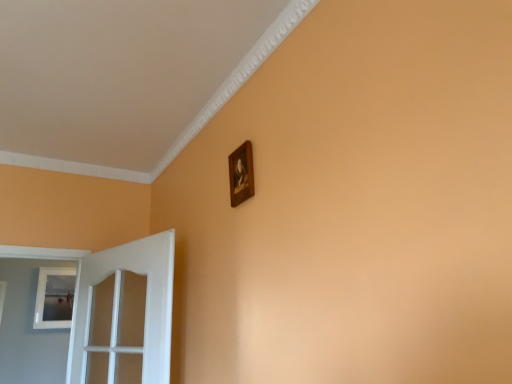
Locate an element on the screen. The height and width of the screenshot is (384, 512). wooden frame at upper center, which appears as the 2th picture frame when ordered from the bottom is located at coordinates click(x=241, y=174).

Locate an element on the screen. wooden frame at upper center, which appears as the 2th picture frame when ordered from the bottom is located at coordinates (241, 174).

Considering the relative positions of white matte picture frame at left, which ranks as the 1th picture frame in left-to-right order, and white glossy door at left in the image provided, is white matte picture frame at left, which ranks as the 1th picture frame in left-to-right order, to the left or to the right of white glossy door at left?

In the image, white matte picture frame at left, which ranks as the 1th picture frame in left-to-right order, appears on the left side of white glossy door at left.

Is white matte picture frame at left, which ranks as the second picture frame in front-to-back order, inside the boundaries of white glossy door at left, or outside?

white matte picture frame at left, which ranks as the second picture frame in front-to-back order, lies outside white glossy door at left.

Which is in front, point (229, 166) or point (69, 268)?

Positioned in front is point (229, 166).

Is wooden frame at upper center, which is counted as the 1th picture frame, starting from the front, with white matte picture frame at left, which ranks as the 1th picture frame in left-to-right order?

No.

Considering the sizes of objects wooden frame at upper center, the first picture frame in the right-to-left sequence, and white matte picture frame at left, positioned as the 2th picture frame in top-to-bottom order, in the image provided, who is wider, wooden frame at upper center, the first picture frame in the right-to-left sequence, or white matte picture frame at left, positioned as the 2th picture frame in top-to-bottom order,?

With larger width is white matte picture frame at left, positioned as the 2th picture frame in top-to-bottom order.

Is wooden frame at upper center, which is the second picture frame in left-to-right order, next to white glossy door at left?

No, wooden frame at upper center, which is the second picture frame in left-to-right order, is not making contact with white glossy door at left.

From their relative heights in the image, would you say wooden frame at upper center, which is the 2th picture frame from back to front, is taller or shorter than white glossy door at left?

In the image, wooden frame at upper center, which is the 2th picture frame from back to front, appears to be shorter than white glossy door at left.

In the scene shown: Is white matte picture frame at left, which is counted as the first picture frame, starting from the back, positioned far away from wooden frame at upper center, which is counted as the 1th picture frame, starting from the front?

Yes, white matte picture frame at left, which is counted as the first picture frame, starting from the back, and wooden frame at upper center, which is counted as the 1th picture frame, starting from the front, are located far from each other.

Does white matte picture frame at left, which ranks as the 1th picture frame in left-to-right order, appear on the right side of wooden frame at upper center, the first picture frame in the right-to-left sequence?

No.

Considering the relative sizes of white matte picture frame at left, which ranks as the 1th picture frame in left-to-right order, and wooden frame at upper center, the first picture frame in the right-to-left sequence, in the image provided, is white matte picture frame at left, which ranks as the 1th picture frame in left-to-right order, thinner than wooden frame at upper center, the first picture frame in the right-to-left sequence,?

In fact, white matte picture frame at left, which ranks as the 1th picture frame in left-to-right order, might be wider than wooden frame at upper center, the first picture frame in the right-to-left sequence.

Is white matte picture frame at left, positioned as the 2th picture frame in top-to-bottom order, oriented away from wooden frame at upper center, which appears as the 2th picture frame when ordered from the bottom?

No, white matte picture frame at left, positioned as the 2th picture frame in top-to-bottom order, is not facing away from wooden frame at upper center, which appears as the 2th picture frame when ordered from the bottom.

Consider the image. Is the position of white glossy door at left less distant than that of wooden frame at upper center, which is the second picture frame in left-to-right order?

No, it is not.

Is white glossy door at left completely or partially outside of wooden frame at upper center, the first picture frame in the right-to-left sequence?

Yes, white glossy door at left is located beyond the bounds of wooden frame at upper center, the first picture frame in the right-to-left sequence.

Between white glossy door at left and wooden frame at upper center, which is the second picture frame in left-to-right order, which one has larger size?

With larger size is white glossy door at left.

Is white glossy door at left positioned beyond the bounds of white matte picture frame at left, positioned as the 2th picture frame in top-to-bottom order?

Yes, white glossy door at left is outside of white matte picture frame at left, positioned as the 2th picture frame in top-to-bottom order.

Is point (159, 358) farther from viewer compared to point (35, 325)?

That is False.

From the image's perspective, is white glossy door at left on top of white matte picture frame at left, positioned as the 2th picture frame in top-to-bottom order?

Indeed, from the image's perspective, white glossy door at left is shown above white matte picture frame at left, positioned as the 2th picture frame in top-to-bottom order.

Does white glossy door at left come in front of white matte picture frame at left, arranged as the 2th picture frame when viewed from the right?

Yes, it is.

Identify the location of door to the right of white matte picture frame at left, which is counted as the first picture frame, starting from the back. (119, 307).

At what (x,y) coordinates should I click in order to perform the action: click on picture frame above the white matte picture frame at left, which is counted as the first picture frame, starting from the back (from a real-world perspective). Please return your answer as a coordinate pair (x, y). Looking at the image, I should click on (241, 174).

When comparing their distances from white glossy door at left, does white matte picture frame at left, positioned as the 2th picture frame in top-to-bottom order, or wooden frame at upper center, which is counted as the 1th picture frame, starting from the front, seem closer?

The object closer to white glossy door at left is wooden frame at upper center, which is counted as the 1th picture frame, starting from the front.

Based on their spatial positions, is white glossy door at left or wooden frame at upper center, which is counted as the 1th picture frame, starting from the front, further from white matte picture frame at left, acting as the 1th picture frame starting from the bottom?

The object further to white matte picture frame at left, acting as the 1th picture frame starting from the bottom, is wooden frame at upper center, which is counted as the 1th picture frame, starting from the front.

Which object lies further to the anchor point white glossy door at left, wooden frame at upper center, which is the 2th picture frame from back to front, or white matte picture frame at left, positioned as the 2th picture frame in top-to-bottom order?

white matte picture frame at left, positioned as the 2th picture frame in top-to-bottom order, is further to white glossy door at left.

Which object lies nearer to the anchor point white matte picture frame at left, which is counted as the first picture frame, starting from the back, wooden frame at upper center, which appears as the 2th picture frame when ordered from the bottom, or white glossy door at left?

Based on the image, white glossy door at left appears to be nearer to white matte picture frame at left, which is counted as the first picture frame, starting from the back.

Considering their positions, is white matte picture frame at left, which ranks as the second picture frame in front-to-back order, positioned closer to wooden frame at upper center, which is the 2th picture frame from back to front, than white glossy door at left?

white glossy door at left.

When comparing their distances from wooden frame at upper center, the first picture frame in the top-to-bottom sequence, does white glossy door at left or white matte picture frame at left, positioned as the 2th picture frame in top-to-bottom order, seem closer?

Result: Based on the image, white glossy door at left appears to be nearer to wooden frame at upper center, the first picture frame in the top-to-bottom sequence.

Locate an element on the screen. door between wooden frame at upper center, the first picture frame in the top-to-bottom sequence, and white matte picture frame at left, arranged as the 2th picture frame when viewed from the right, in the front-back direction is located at coordinates (119, 307).